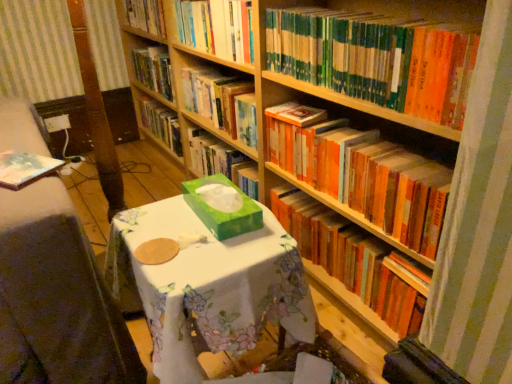
Question: Can you confirm if orange matte bookshelf at upper right, marked as the 4th book in a top-to-bottom arrangement, is thinner than hardcover books at upper center, which appears as the fifth book when ordered from the bottom?

Choices:
 (A) no
 (B) yes

Answer: (A)

Question: Does orange matte bookshelf at upper right, positioned as the 2th book in bottom-to-top order, appear on the left side of hardcover books at upper center, which appears as the fifth book when ordered from the bottom?

Choices:
 (A) yes
 (B) no

Answer: (B)

Question: From a real-world perspective, is orange matte bookshelf at upper right, marked as the 4th book in a top-to-bottom arrangement, under hardcover books at upper center, positioned as the 1th book in top-to-bottom order?

Choices:
 (A) yes
 (B) no

Answer: (A)

Question: Is orange matte bookshelf at upper right, marked as the 4th book in a top-to-bottom arrangement, directly adjacent to hardcover books at upper center, positioned as the 1th book in top-to-bottom order?

Choices:
 (A) yes
 (B) no

Answer: (B)

Question: Is orange matte bookshelf at upper right, marked as the 4th book in a top-to-bottom arrangement, not close to hardcover books at upper center, positioned as the 1th book in top-to-bottom order?

Choices:
 (A) yes
 (B) no

Answer: (B)

Question: Is orange matte bookshelf at upper right, positioned as the 2th book in bottom-to-top order, oriented towards hardcover books at upper center, positioned as the 1th book in top-to-bottom order?

Choices:
 (A) yes
 (B) no

Answer: (B)

Question: Does green floral tablecloth at center have a larger size compared to hardcover books at upper center, which appears as the fifth book when ordered from the bottom?

Choices:
 (A) yes
 (B) no

Answer: (A)

Question: Is green floral tablecloth at center not within hardcover books at upper center, positioned as the 1th book in top-to-bottom order?

Choices:
 (A) yes
 (B) no

Answer: (A)

Question: Can you confirm if green floral tablecloth at center is taller than hardcover books at upper center, positioned as the 1th book in top-to-bottom order?

Choices:
 (A) no
 (B) yes

Answer: (B)

Question: Is the depth of green floral tablecloth at center less than that of hardcover books at upper center, which appears as the fifth book when ordered from the bottom?

Choices:
 (A) no
 (B) yes

Answer: (B)

Question: From the image's perspective, would you say green floral tablecloth at center is positioned over hardcover books at upper center, which appears as the fifth book when ordered from the bottom?

Choices:
 (A) no
 (B) yes

Answer: (A)

Question: Is green floral tablecloth at center facing away from hardcover books at upper center, positioned as the 1th book in top-to-bottom order?

Choices:
 (A) no
 (B) yes

Answer: (A)

Question: Does hardcover book at center, which is the second book in top-to-bottom order, have a larger size compared to hardcover books at upper center, positioned as the 1th book in top-to-bottom order?

Choices:
 (A) no
 (B) yes

Answer: (B)